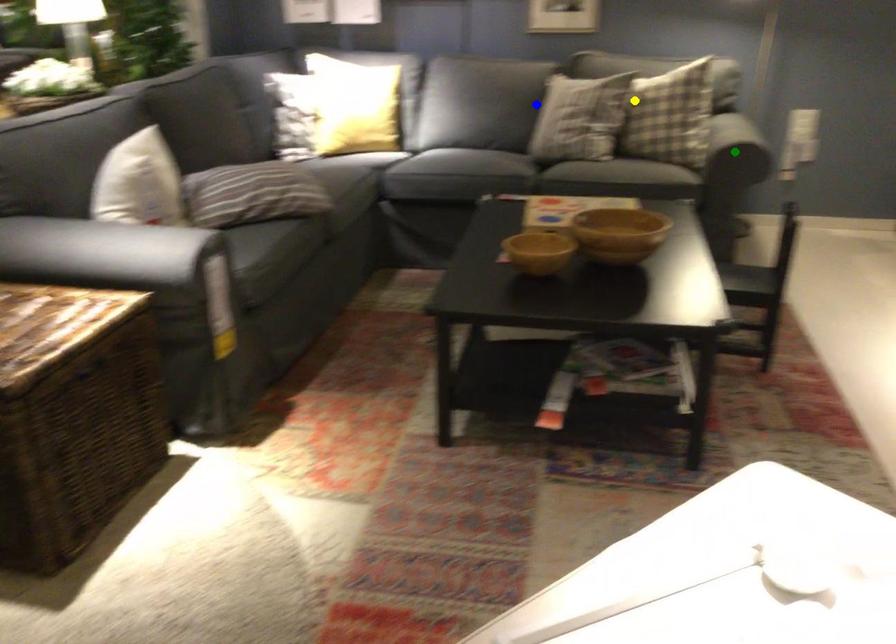
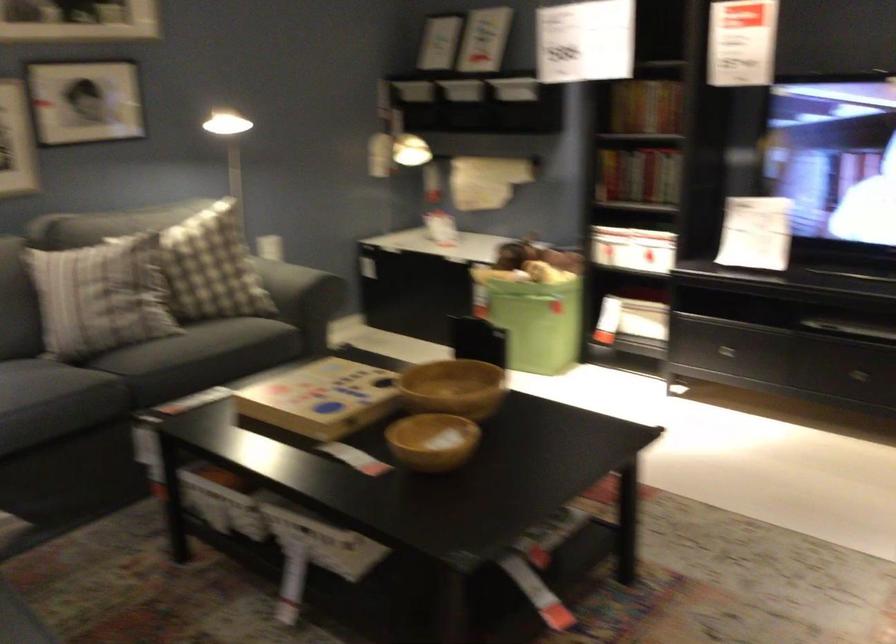
I am providing you with two images of the same scene from different viewpoints. Three points are marked in image1. Which point corresponds to a part or object that is occluded in image2?In image1, three points are marked. Which of them correspond to a part or object that is occluded in image2?Among the three points shown in image1, which one corresponds to a part or object that is no longer visible due to occlusion in image2?

green point